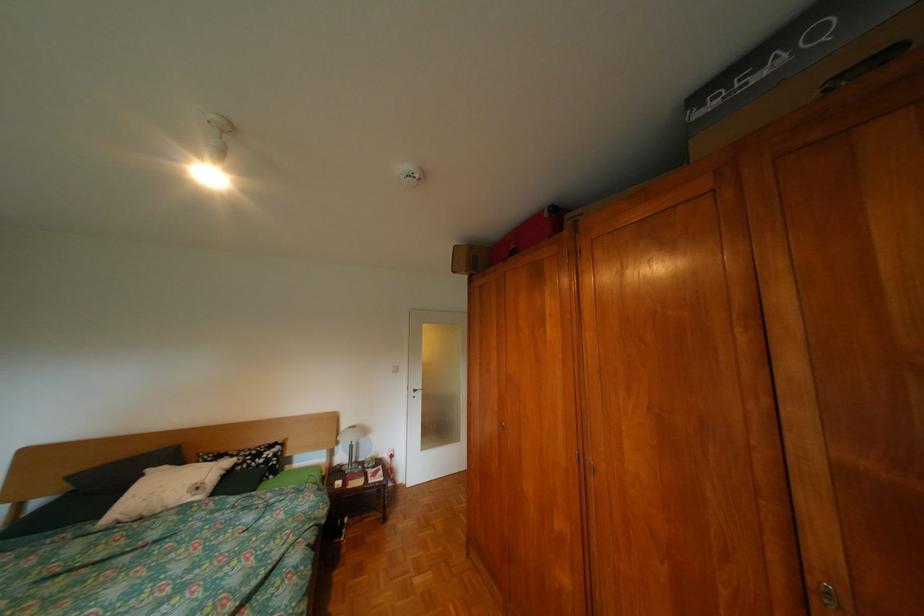
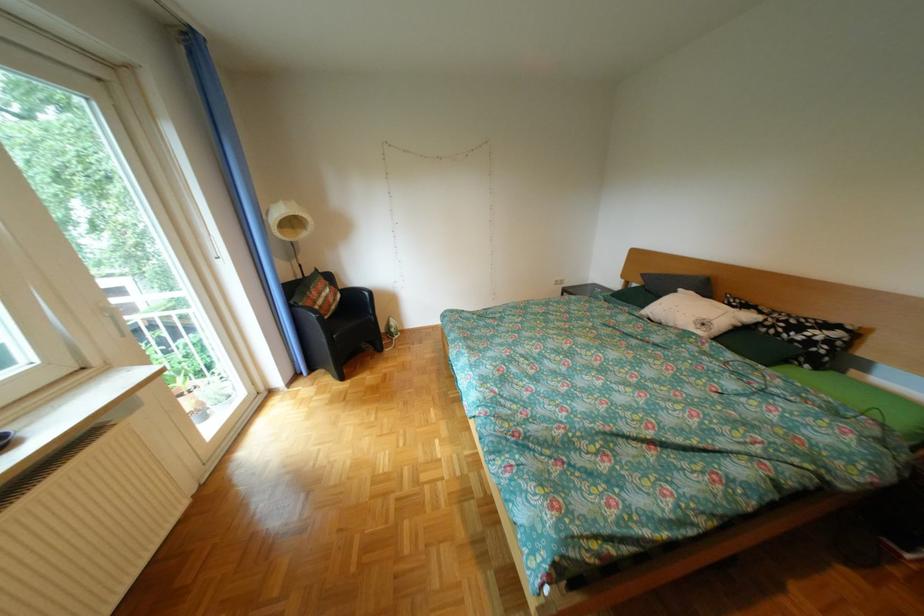
Where in the second image is the point corresponding to point 247,456 from the first image?

(775, 313)